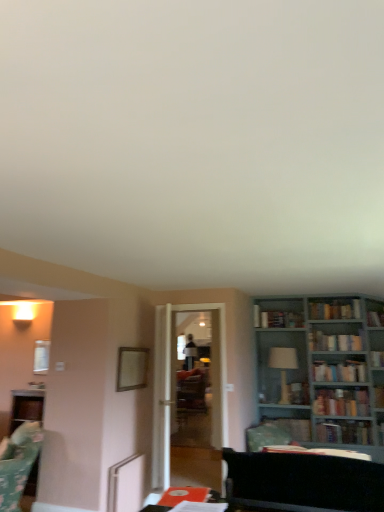
Identify the location of hardcover book at right, which is counted as the fifth book, starting from the back. This screenshot has height=512, width=384. (340, 371).

How much space does hardcover book at upper right, arranged as the first book when viewed from the back, occupy horizontally?

It is 15.00 inches.

This screenshot has width=384, height=512. In order to click on hardcover book at upper right, which is the 8th book in front-to-back order in this screenshot , I will do `click(277, 318)`.

Find the location of `matte orange book at lower center, the eighth book viewed from the back`. matte orange book at lower center, the eighth book viewed from the back is located at coordinates (183, 495).

Identify the location of shiny metallic bookshelf at right, the sixth book when ordered from back to front. The width and height of the screenshot is (384, 512). (341, 402).

At what (x,y) coordinates should I click in order to perform the action: click on teal wooden bookcase at right. Please return your answer as a coordinate pair (x, y). The height and width of the screenshot is (512, 384). Looking at the image, I should click on (324, 373).

Is the depth of hardcover book at right, the 7th book from the back, greater than that of white glossy lampshade at center-right?

No, hardcover book at right, the 7th book from the back, is closer to the camera.

Is white glossy lampshade at center-right completely or partially inside hardcover book at right, the 7th book from the back?

That's incorrect, white glossy lampshade at center-right is not inside hardcover book at right, the 7th book from the back.

How far apart are hardcover book at right, the 7th book from the back, and white glossy lampshade at center-right?

They are 80.91 centimeters apart.

What's the angular difference between hardcover book at right, the 7th book from the back, and white glossy lampshade at center-right's facing directions?

hardcover book at right, the 7th book from the back, and white glossy lampshade at center-right are facing 0.695 degrees away from each other.

Considering the points (293, 348) and (10, 472), which point is in front, point (293, 348) or point (10, 472)?

The point (10, 472) is closer.

Would you say white glossy lampshade at center-right is outside green fabric swivel chair at lower left?

Yes, white glossy lampshade at center-right is outside of green fabric swivel chair at lower left.

In terms of size, does white glossy lampshade at center-right appear bigger or smaller than green fabric swivel chair at lower left?

white glossy lampshade at center-right is smaller than green fabric swivel chair at lower left.

From the picture: From a real-world perspective, which object stands above the other?

In real-world perspective, hardcover book at upper right, which is the 8th book in front-to-back order, is above.

Is wooden picture frame at upper center to the left or to the right of hardcover book at upper right, arranged as the first book when viewed from the back, in the image?

In the image, wooden picture frame at upper center appears on the left side of hardcover book at upper right, arranged as the first book when viewed from the back.

Is there a large distance between wooden picture frame at upper center and hardcover book at upper right, which is the 8th book in front-to-back order?

Yes, wooden picture frame at upper center and hardcover book at upper right, which is the 8th book in front-to-back order, are located far from each other.

Does wooden picture frame at upper center have a larger size compared to hardcover book at upper right, which is the 8th book in front-to-back order?

No.

Is hardcover book at center, the 3th book positioned from the back, not close to wooden picture frame at upper center?

Yes.

Based on their positions, is hardcover book at center, which appears as the 6th book when viewed from the front, located to the left or right of wooden picture frame at upper center?

In the image, hardcover book at center, which appears as the 6th book when viewed from the front, appears on the right side of wooden picture frame at upper center.

Is point (291, 425) positioned in front of point (143, 375)?

No, (291, 425) is behind (143, 375).

From the image's perspective, which is below, hardcover book at center, the 3th book positioned from the back, or wooden picture frame at upper center?

hardcover book at center, the 3th book positioned from the back, is shown below in the image.

Can you confirm if wooden picture frame at upper center is positioned to the right of matte orange book at lower center, the eighth book viewed from the back?

No.

Is wooden picture frame at upper center far from matte orange book at lower center, the eighth book viewed from the back?

wooden picture frame at upper center is positioned a significant distance from matte orange book at lower center, the eighth book viewed from the back.

Considering the positions of objects wooden picture frame at upper center and matte orange book at lower center, the eighth book viewed from the back, in the image provided, who is behind, wooden picture frame at upper center or matte orange book at lower center, the eighth book viewed from the back,?

wooden picture frame at upper center.

Is green fabric swivel chair at lower left to the left of hardcover book at right, arranged as the 2th book when viewed from the front, from the viewer's perspective?

Yes, green fabric swivel chair at lower left is to the left of hardcover book at right, arranged as the 2th book when viewed from the front.

From a real-world perspective, who is located higher, green fabric swivel chair at lower left or hardcover book at right, the 7th book from the back?

In real-world perspective, hardcover book at right, the 7th book from the back, is above.

Would you say hardcover book at right, arranged as the 2th book when viewed from the front, is part of green fabric swivel chair at lower left's contents?

No, hardcover book at right, arranged as the 2th book when viewed from the front, is not inside green fabric swivel chair at lower left.

Is green fabric swivel chair at lower left looking in the opposite direction of hardcover book at right, arranged as the 2th book when viewed from the front?

Yes, green fabric swivel chair at lower left is facing away from hardcover book at right, arranged as the 2th book when viewed from the front.

Is matte orange book at lower center, which is the first book from front to back, positioned behind hardcover book at right, the 7th book from the back?

No, matte orange book at lower center, which is the first book from front to back, is in front of hardcover book at right, the 7th book from the back.

From the image's perspective, which one is positioned higher, matte orange book at lower center, which is the first book from front to back, or hardcover book at right, arranged as the 2th book when viewed from the front?

matte orange book at lower center, which is the first book from front to back, appears higher in the image.

Considering the sizes of matte orange book at lower center, which is the first book from front to back, and hardcover book at right, the 7th book from the back, in the image, is matte orange book at lower center, which is the first book from front to back, bigger or smaller than hardcover book at right, the 7th book from the back,?

Clearly, matte orange book at lower center, which is the first book from front to back, is smaller in size than hardcover book at right, the 7th book from the back.

In terms of height, does matte orange book at lower center, which is the first book from front to back, look taller or shorter compared to hardcover book at right, the 7th book from the back?

In the image, matte orange book at lower center, which is the first book from front to back, appears to be shorter than hardcover book at right, the 7th book from the back.

The width and height of the screenshot is (384, 512). What are the coordinates of `fixture that appears behind the hardcover book at right, the 7th book from the back` in the screenshot? It's located at 283,367.

Locate an element on the screen. This screenshot has height=512, width=384. swivel chair located on the left of white glossy lampshade at center-right is located at coordinates (18, 463).

Based on their spatial positions, is matte orange book at lower center, the eighth book viewed from the back, or hardcover book at center, the 3th book positioned from the back, closer to hardcover book at upper right, which is the 8th book in front-to-back order?

Among the two, hardcover book at center, the 3th book positioned from the back, is located nearer to hardcover book at upper right, which is the 8th book in front-to-back order.

Based on their spatial positions, is wooden picture frame at upper center or teal wooden bookcase at right further from white glossy lampshade at center-right?

The object further to white glossy lampshade at center-right is wooden picture frame at upper center.

From the picture: Estimate the real-world distances between objects in this image. Which object is closer to matte orange book at lower center, which is the first book from front to back, wooden picture frame at upper center or white glossy lampshade at center-right?

wooden picture frame at upper center is positioned closer to the anchor matte orange book at lower center, which is the first book from front to back.

Which object lies nearer to the anchor point black fabric futon at lower right, white glossy lampshade at center-right or hardcover book at right, arranged as the 2th book when viewed from the front?

white glossy lampshade at center-right is positioned closer to the anchor black fabric futon at lower right.

Based on the photo, when comparing their distances from hardcover book at upper right, which is the 8th book in front-to-back order, does matte orange book at lower center, which is the first book from front to back, or white glossy lampshade at center-right seem further?

matte orange book at lower center, which is the first book from front to back.

From the image, which object appears to be nearer to matte orange book at lower center, the eighth book viewed from the back, hardcover book at upper center, acting as the 4th book starting from the back, or hardcover books at right, the 7th book when ordered from front to back?

Based on the image, hardcover book at upper center, acting as the 4th book starting from the back, appears to be nearer to matte orange book at lower center, the eighth book viewed from the back.

Looking at the image, which one is located closer to hardcover books at right, the 7th book when ordered from front to back, hardcover book at upper right, arranged as the first book when viewed from the back, or hardcover book at center, which appears as the 6th book when viewed from the front?

Based on the image, hardcover book at upper right, arranged as the first book when viewed from the back, appears to be nearer to hardcover books at right, the 7th book when ordered from front to back.

Considering their positions, is green fabric swivel chair at lower left positioned closer to teal wooden bookcase at right than hardcover book at right, the 7th book from the back?

The object closer to teal wooden bookcase at right is hardcover book at right, the 7th book from the back.

Where is `fixture situated between wooden picture frame at upper center and shiny metallic bookshelf at right, placed as the third book when sorted from front to back, from left to right`? fixture situated between wooden picture frame at upper center and shiny metallic bookshelf at right, placed as the third book when sorted from front to back, from left to right is located at coordinates (283, 367).

At what (x,y) coordinates should I click in order to perform the action: click on bookcase between white glossy lampshade at center-right and hardcover book at right, arranged as the 2th book when viewed from the front. Please return your answer as a coordinate pair (x, y). The image size is (384, 512). Looking at the image, I should click on 324,373.

Locate an element on the screen. book between black fabric futon at lower right and wooden picture frame at upper center in the front-back direction is located at coordinates (183, 495).

At what (x,y) coordinates should I click in order to perform the action: click on bookcase located between transparent glass door at center and hardcover books at right, the 2th book from the back, in the left-right direction. Please return your answer as a coordinate pair (x, y). The width and height of the screenshot is (384, 512). Looking at the image, I should click on (324, 373).